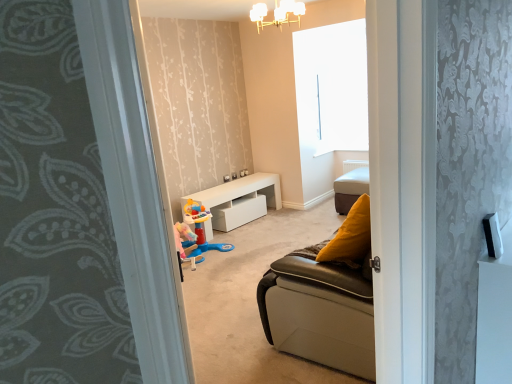
Question: Visually, is pastel pink plastic toy at center positioned to the left or to the right of gray floral carpet at left?

Choices:
 (A) right
 (B) left

Answer: (B)

Question: In terms of width, does pastel pink plastic toy at center look wider or thinner when compared to gray floral carpet at left?

Choices:
 (A) wide
 (B) thin

Answer: (A)

Question: Based on their relative distances, which object is farther from the gray floral carpet at left?

Choices:
 (A) pastel pink plastic toy at center
 (B) white glossy table at center
 (C) white frosted glass chandelier at upper center
 (D) leather cushion at center

Answer: (D)

Question: Based on their relative distances, which object is farther from the gray floral carpet at left?

Choices:
 (A) leather cushion at center
 (B) white glossy table at center
 (C) pastel pink plastic toy at center
 (D) white frosted glass chandelier at upper center

Answer: (A)